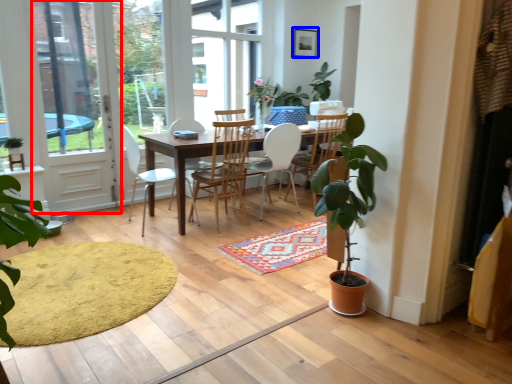
Question: Which object is closer to the camera taking this photo, screen door (highlighted by a red box) or picture frame (highlighted by a blue box)?

Choices:
 (A) screen door
 (B) picture frame

Answer: (A)